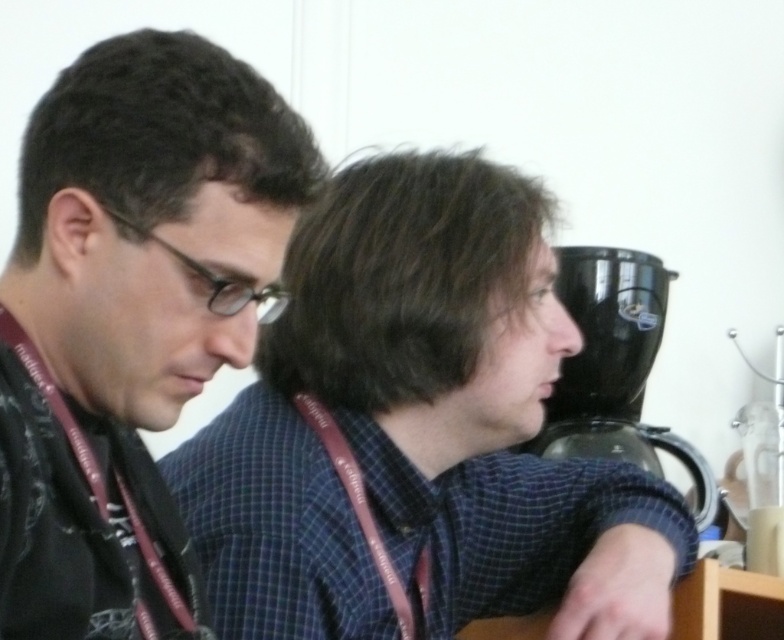
Which is below, blue checkered shirt at center or matte black shirt at left?

blue checkered shirt at center

Measure the distance between blue checkered shirt at center and camera.

blue checkered shirt at center is 87.82 centimeters from camera.

The height and width of the screenshot is (640, 784). What are the coordinates of `blue checkered shirt at center` in the screenshot? It's located at (420, 429).

Which of these two, matte black shirt at left or black plastic coffee machine at right, stands shorter?

matte black shirt at left

Is matte black shirt at left thinner than black plastic coffee machine at right?

Indeed, matte black shirt at left has a lesser width compared to black plastic coffee machine at right.

Describe the element at coordinates (129, 317) in the screenshot. This screenshot has height=640, width=784. I see `matte black shirt at left` at that location.

Image resolution: width=784 pixels, height=640 pixels. What are the coordinates of `matte black shirt at left` in the screenshot? It's located at [129, 317].

Can you confirm if blue checkered shirt at center is taller than black plastic coffee machine at right?

Correct, blue checkered shirt at center is much taller as black plastic coffee machine at right.

Is point (521, 323) behind point (672, 445)?

That is False.

Is point (507, 218) in front of point (699, 481)?

Yes, it is.

At what (x,y) coordinates should I click in order to perform the action: click on blue checkered shirt at center. Please return your answer as a coordinate pair (x, y). This screenshot has width=784, height=640. Looking at the image, I should click on (420, 429).